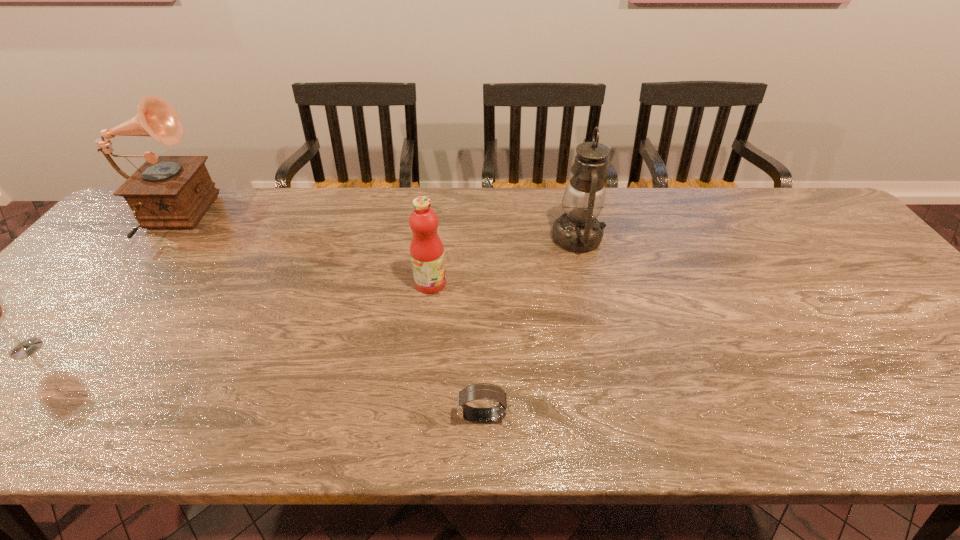
At what (x,y) coordinates should I click in order to perform the action: click on vacant space that satisfies the following two spatial constraints: 1. on the horn of the oil lamp; 2. on the right side of the record player. Please return your answer as a coordinate pair (x, y). This screenshot has height=540, width=960. Looking at the image, I should click on (154, 238).